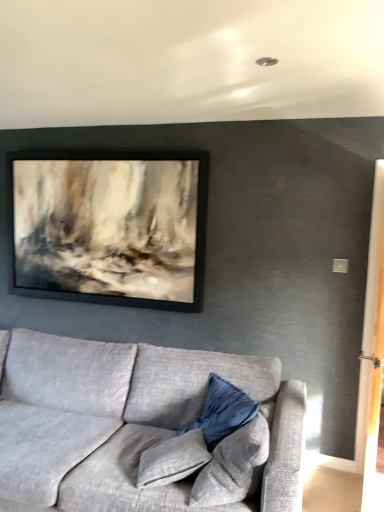
Question: Considering the positions of velvet blue pillow at lower center, the 1th pillow in the front-to-back sequence, and velvet blue pillow at center, arranged as the 2th pillow when viewed from the front, in the image, is velvet blue pillow at lower center, the 1th pillow in the front-to-back sequence, wider or thinner than velvet blue pillow at center, arranged as the 2th pillow when viewed from the front,?

Choices:
 (A) wide
 (B) thin

Answer: (A)

Question: From the image's perspective, is velvet blue pillow at lower center, the 2th pillow viewed from the back, located above or below velvet blue pillow at center, arranged as the 2th pillow when viewed from the front?

Choices:
 (A) below
 (B) above

Answer: (B)

Question: Considering the real-world distances, which object is closest to the textured gray couch at lower left?

Choices:
 (A) velvet blue pillow at center, placed as the 1th pillow when sorted from back to front
 (B) velvet blue pillow at lower center, the 2th pillow viewed from the back

Answer: (A)

Question: Estimate the real-world distances between objects in this image. Which object is farther from the textured gray couch at lower left?

Choices:
 (A) velvet blue pillow at center, placed as the 1th pillow when sorted from back to front
 (B) velvet blue pillow at lower center, the 2th pillow viewed from the back

Answer: (B)